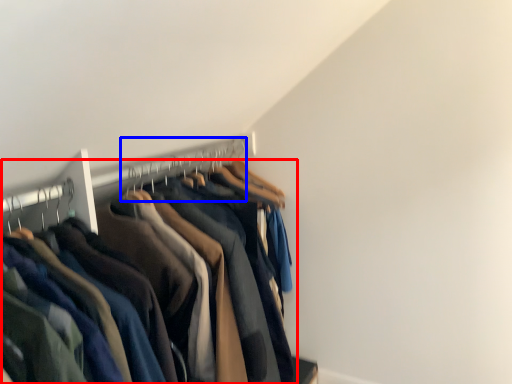
Question: Which point is further to the camera, trousers (highlighted by a red box) or hanger (highlighted by a blue box)?

Choices:
 (A) trousers
 (B) hanger

Answer: (B)